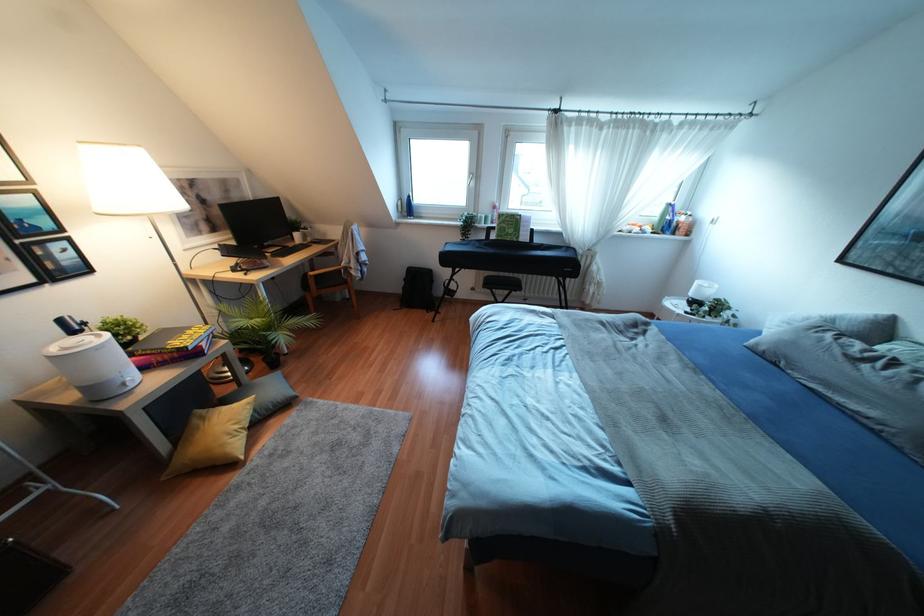
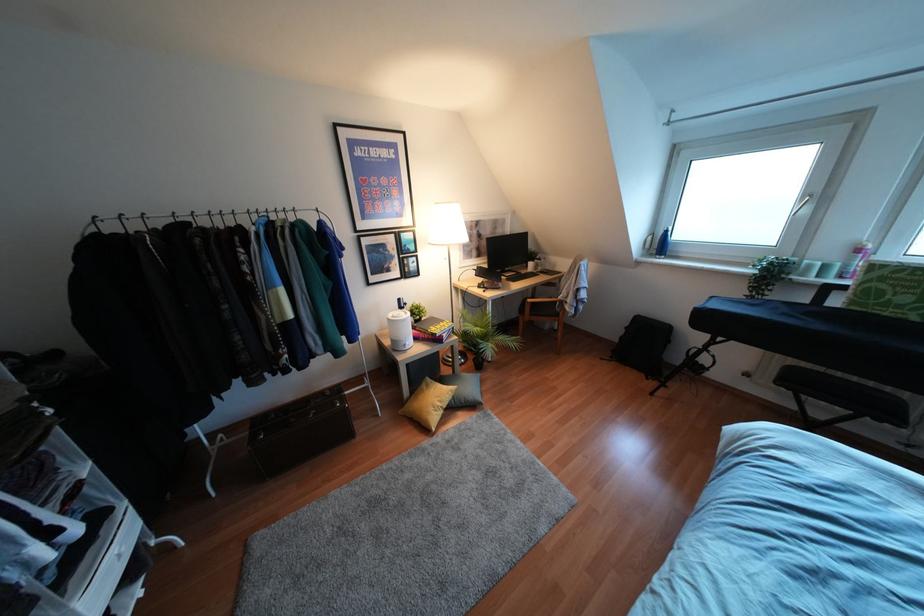
The point at (403,286) is marked in the first image. Where is the corresponding point in the second image?

(621, 337)